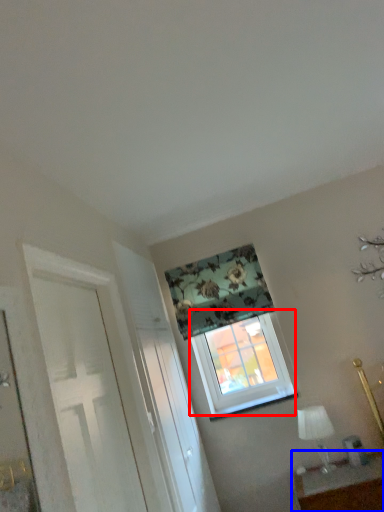
Question: Among these objects, which one is farthest to the camera, window (highlighted by a red box) or table (highlighted by a blue box)?

Choices:
 (A) window
 (B) table

Answer: (A)